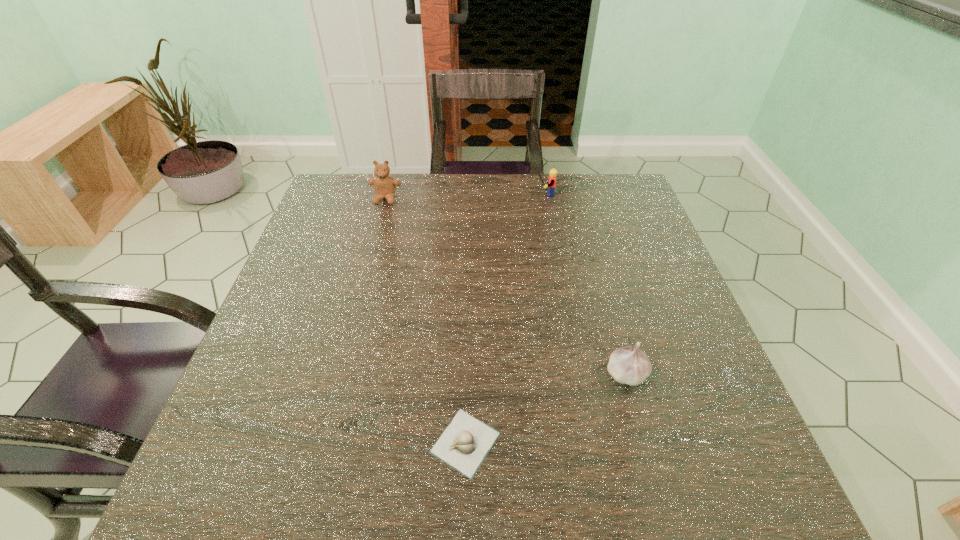
In the image, there is a desktop. Identify the location of vacant space at the left edge. (345, 235).

In the image, there is a desktop. Identify the location of vacant space at the right edge. (653, 406).

Find the location of a particular element. vacant space at the far right corner is located at coordinates (587, 181).

The image size is (960, 540). Identify the location of free space at the near right corner. (713, 492).

Identify the location of free spot between the rightmost object and the shorter garlic. (546, 408).

Locate an element on the screen. This screenshot has height=540, width=960. vacant space that's between the third tallest object and the Lego is located at coordinates (585, 284).

Locate an element on the screen. free space between the farther garlic and the Lego is located at coordinates (585, 284).

At what (x,y) coordinates should I click in order to perform the action: click on vacant area that lies between the leftmost object and the second object from left to right. Please return your answer as a coordinate pair (x, y). This screenshot has width=960, height=540. Looking at the image, I should click on (425, 321).

Find the location of a particular element. Image resolution: width=960 pixels, height=540 pixels. free spot between the left garlic and the teddy bear is located at coordinates (425, 321).

Locate an element on the screen. This screenshot has width=960, height=540. free space that is in between the leftmost object and the second object from right to left is located at coordinates [x=465, y=197].